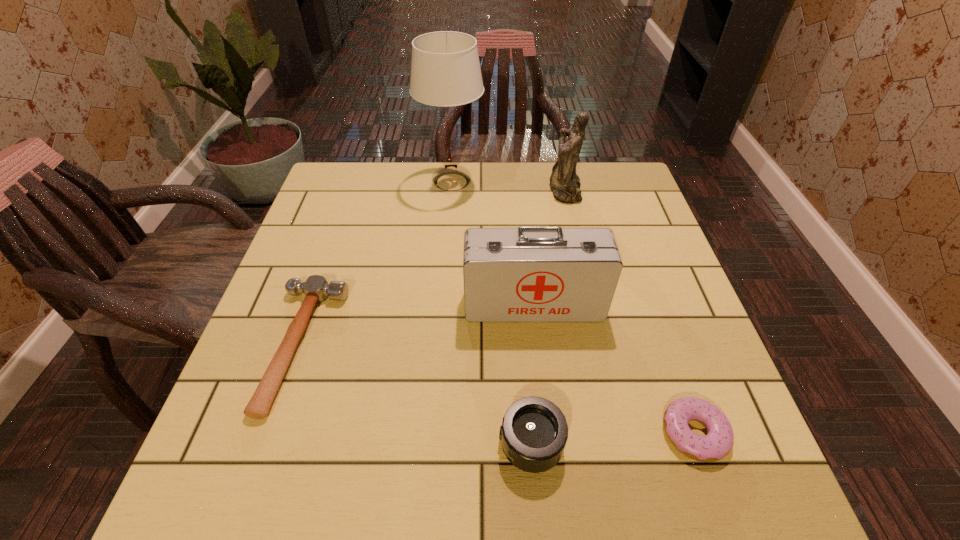
Identify the location of free space that satisfies the following two spatial constraints: 1. on the front-facing side of the first-aid kit; 2. on the right side of the shortest object. (547, 433).

Identify the location of blank space that satisfies the following two spatial constraints: 1. on the front-facing side of the figurine; 2. on the right side of the shortest object. (620, 433).

The width and height of the screenshot is (960, 540). What are the coordinates of `free spot that satisfies the following two spatial constraints: 1. on the back side of the doughnut; 2. on the front-facing side of the second tallest object` in the screenshot? It's located at (610, 190).

Locate an element on the screen. The image size is (960, 540). free location that satisfies the following two spatial constraints: 1. on the front-facing side of the figurine; 2. on the front-facing side of the fourth shortest object is located at coordinates (591, 305).

This screenshot has height=540, width=960. I want to click on vacant space that satisfies the following two spatial constraints: 1. on the front-facing side of the shortest object; 2. on the left side of the first-aid kit, so click(547, 433).